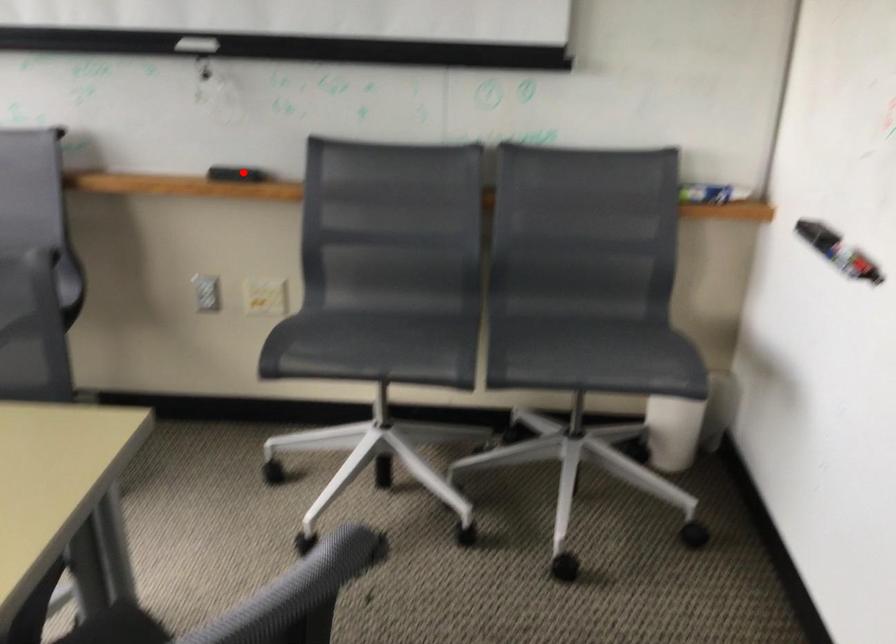
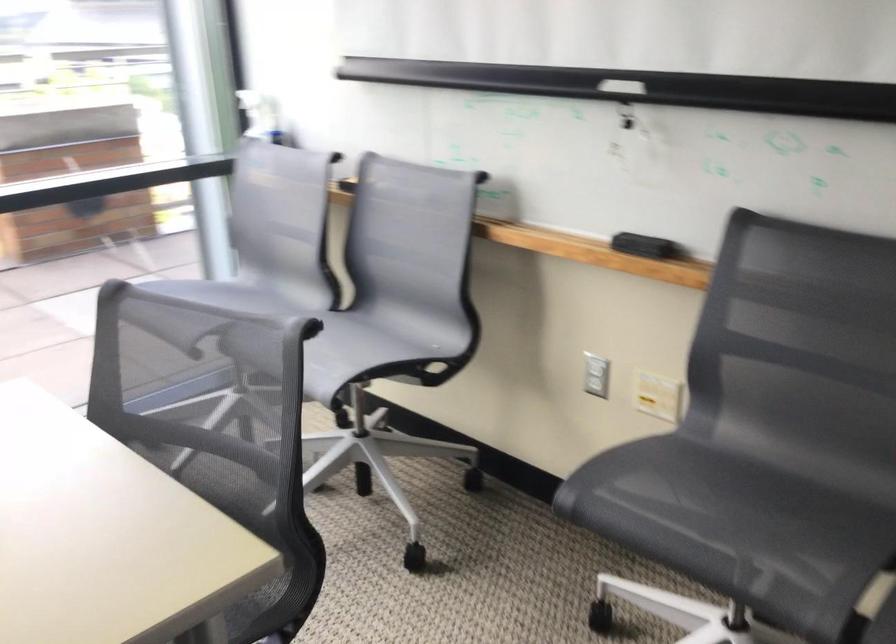
Question: I am providing you with two images of the same scene from different viewpoints. Given a red point in image1, look at the same physical point in image2. Is it:

Choices:
 (A) Closer to the viewpoint
 (B) Farther from the viewpoint

Answer: (A)